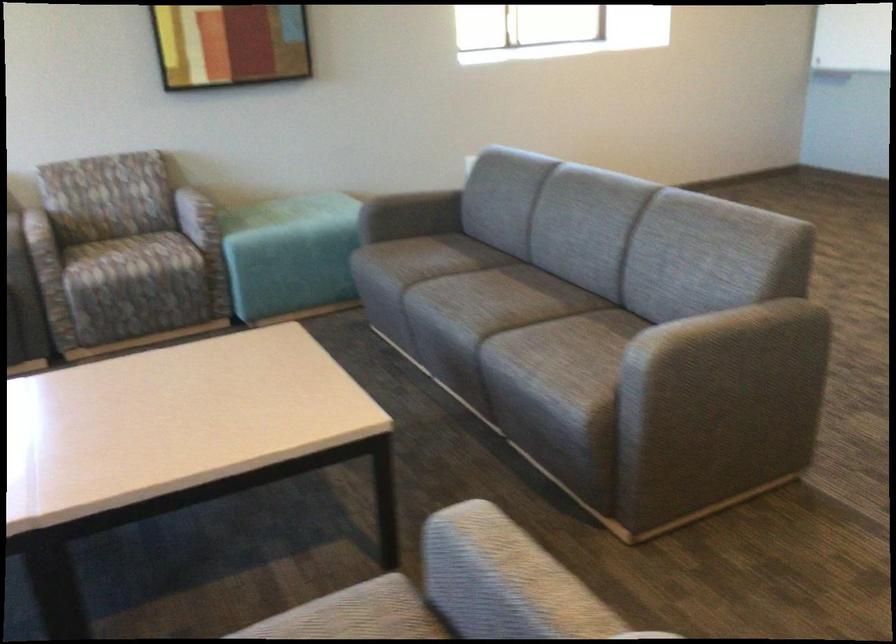
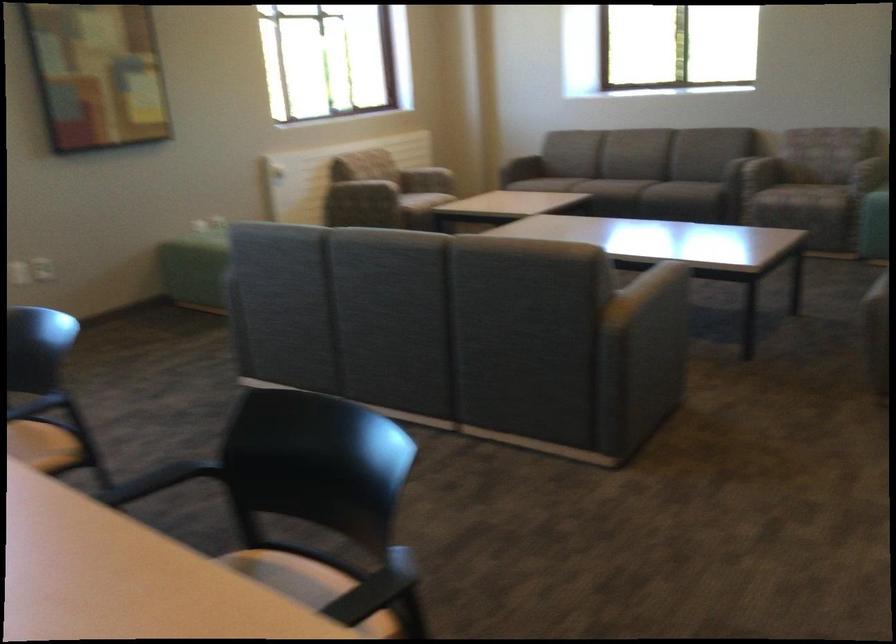
Where in the second image is the point corresponding to [196,254] from the first image?

(807, 184)